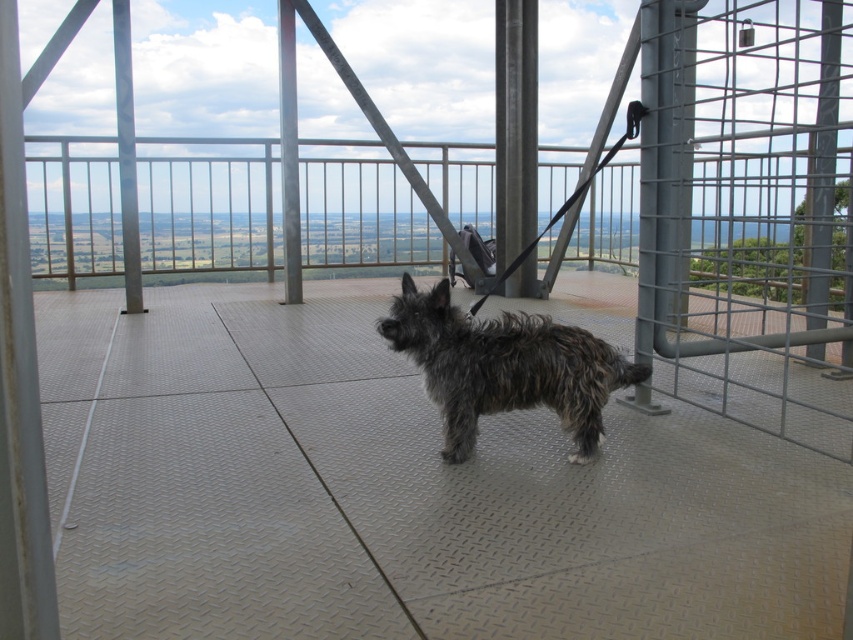
You are a service robot tasked with retrieving a small package from the tower platform. You need to navigate around the metallic grid gate at right and the fuzzy brown dog at center. Which object is positioned higher and must be navigated over or under?

The metallic grid gate at right is above the fuzzy brown dog at center, so you must navigate under the metallic grid gate at right to avoid collision.

You are a service robot tasked with guiding a visitor to the exit. The visitor is currently standing near the fuzzy brown dog at center. The exit is located near the metallic grid gate at right. Can you determine the direction the visitor should walk to reach the exit?

The metallic grid gate at right is to the right of the fuzzy brown dog at center, so the visitor should walk to the right to reach the exit.